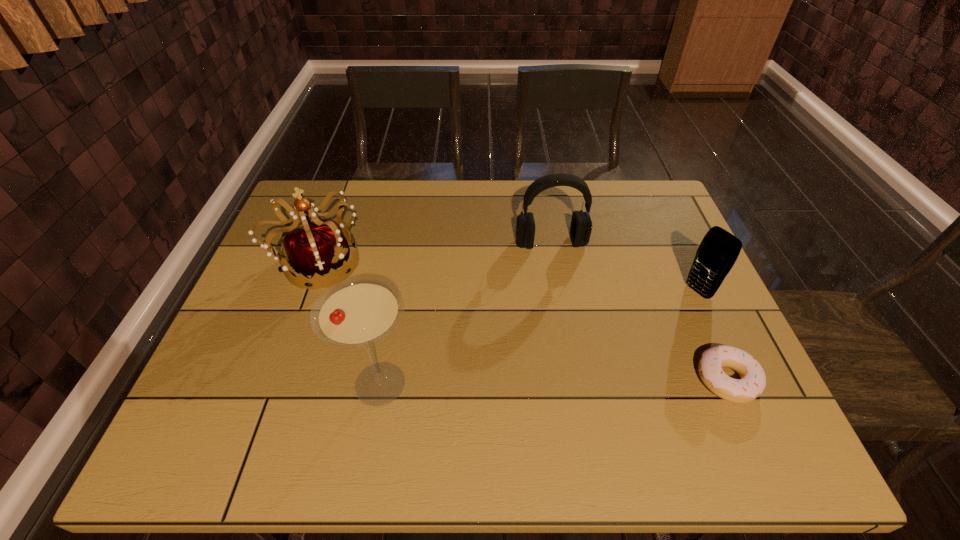
I want to click on blank space located on the screen of the cellular telephone, so [x=576, y=365].

The height and width of the screenshot is (540, 960). Find the location of `free location located on the screen of the cellular telephone`. free location located on the screen of the cellular telephone is located at coordinates (657, 317).

Where is `free space located 0.370m on the screen of the cellular telephone`? This screenshot has width=960, height=540. free space located 0.370m on the screen of the cellular telephone is located at coordinates (580, 363).

I want to click on vacant region located on the headband of the third object from left to right, so click(x=580, y=355).

Identify the location of blank space located on the headband of the third object from left to right. The width and height of the screenshot is (960, 540). (566, 300).

This screenshot has height=540, width=960. In order to click on vacant area situated 0.310m on the headband of the third object from left to right in this screenshot , I will do `click(577, 345)`.

This screenshot has width=960, height=540. Identify the location of martini that is positioned at the near edge. (356, 312).

Locate an element on the screen. The width and height of the screenshot is (960, 540). doughnut present at the near edge is located at coordinates (752, 382).

Find the location of `object located at the left edge`. object located at the left edge is located at coordinates (319, 248).

The height and width of the screenshot is (540, 960). Find the location of `doughnut that is positioned at the right edge`. doughnut that is positioned at the right edge is located at coordinates (752, 382).